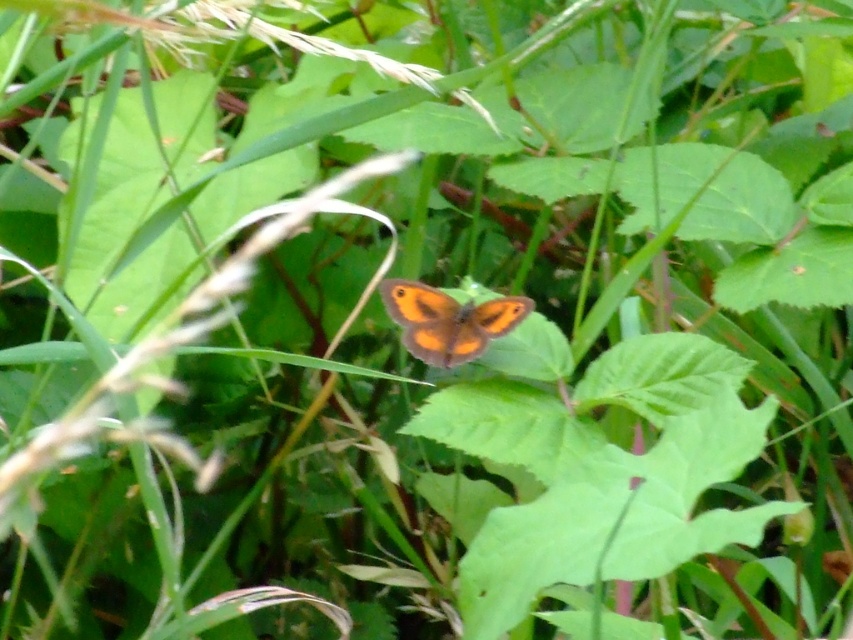
Question: Can you confirm if green matte leaf at center is positioned below orange matte butterfly at center?

Choices:
 (A) no
 (B) yes

Answer: (B)

Question: Is the position of green smooth leaf at center less distant than that of orange matte butterfly at center?

Choices:
 (A) no
 (B) yes

Answer: (B)

Question: Which of these objects is positioned farthest from the green smooth leaf at center?

Choices:
 (A) orange matte butterfly at center
 (B) green matte leaf at center

Answer: (A)

Question: Which point is farther to the camera?

Choices:
 (A) orange matte butterfly at center
 (B) green smooth leaf at center
 (C) green matte leaf at center

Answer: (A)

Question: Estimate the real-world distances between objects in this image. Which object is farther from the green smooth leaf at center?

Choices:
 (A) green matte leaf at center
 (B) orange matte butterfly at center

Answer: (B)

Question: Can you confirm if green matte leaf at center is wider than orange matte butterfly at center?

Choices:
 (A) yes
 (B) no

Answer: (A)